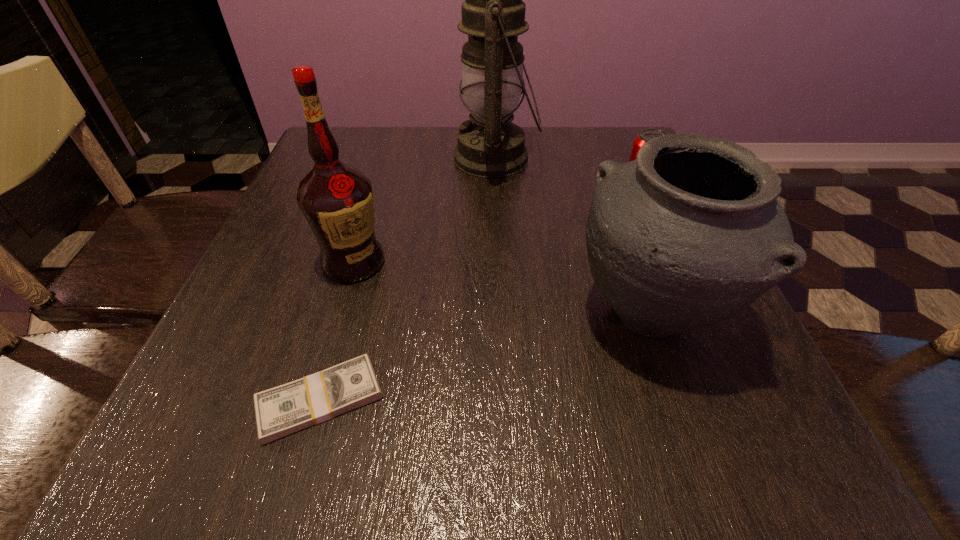
You are a GUI agent. You are given a task and a screenshot of the screen. Output one action in this format:
    pyautogui.click(x=<x>, y=<y>)
    Task: Click on the object that stands as the second closest to the dollar
    The width and height of the screenshot is (960, 540).
    Given the screenshot: What is the action you would take?
    pyautogui.click(x=691, y=233)

Locate which object is the second closest to the oil lamp. Please provide its 2D coordinates. Your answer should be formatted as a tuple, i.e. [(x, y)], where the tuple contains the x and y coordinates of a point satisfying the conditions above.

[(336, 199)]

Where is `free spot that satisfies the following two spatial constraints: 1. on the back side of the dollar; 2. on the left side of the urn`? The height and width of the screenshot is (540, 960). free spot that satisfies the following two spatial constraints: 1. on the back side of the dollar; 2. on the left side of the urn is located at coordinates (344, 315).

Where is `vacant space that satisfies the following two spatial constraints: 1. on the back side of the fourth tallest object; 2. on the left side of the urn`? Image resolution: width=960 pixels, height=540 pixels. vacant space that satisfies the following two spatial constraints: 1. on the back side of the fourth tallest object; 2. on the left side of the urn is located at coordinates (607, 197).

Identify the location of vacant area in the image that satisfies the following two spatial constraints: 1. on the label of the urn; 2. on the right side of the second tallest object. The width and height of the screenshot is (960, 540). (338, 315).

Locate an element on the screen. The width and height of the screenshot is (960, 540). free space that satisfies the following two spatial constraints: 1. on the label of the dollar; 2. on the right side of the alcohol is located at coordinates (313, 400).